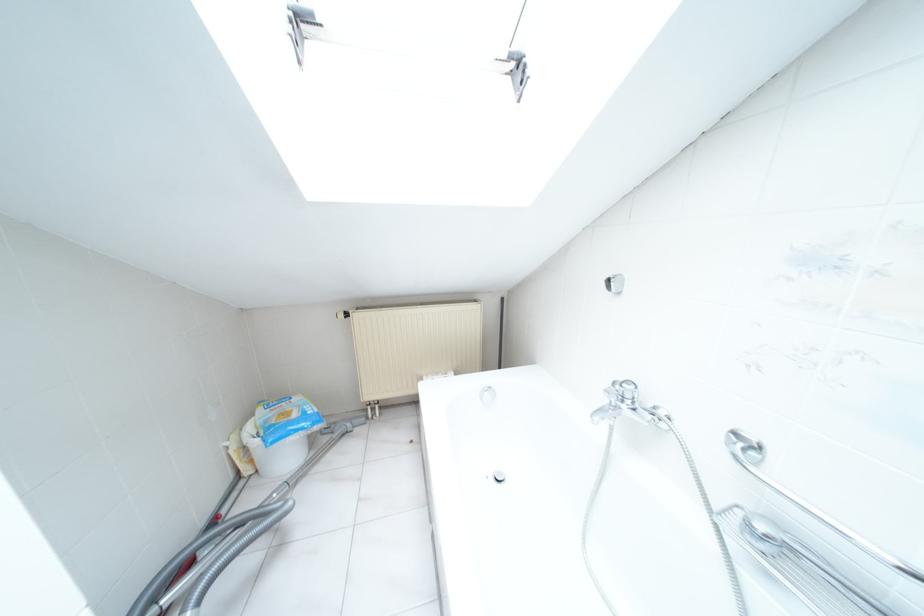
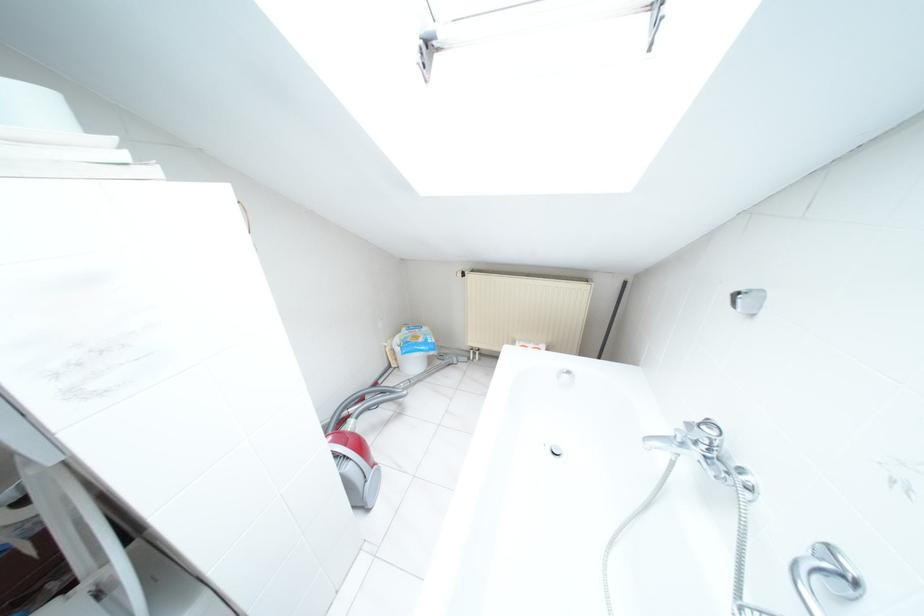
Locate, in the second image, the point that corresponds to point (740, 445) in the first image.

(825, 565)